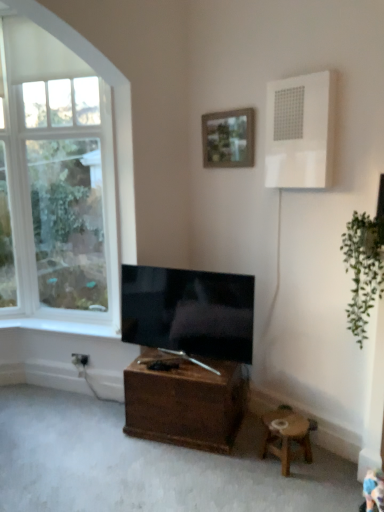
At what (x,y) coordinates should I click in order to perform the action: click on empty space that is ontop of wooden stool at lower right. Please return your answer as a coordinate pair (x, y). Looking at the image, I should click on (287, 421).